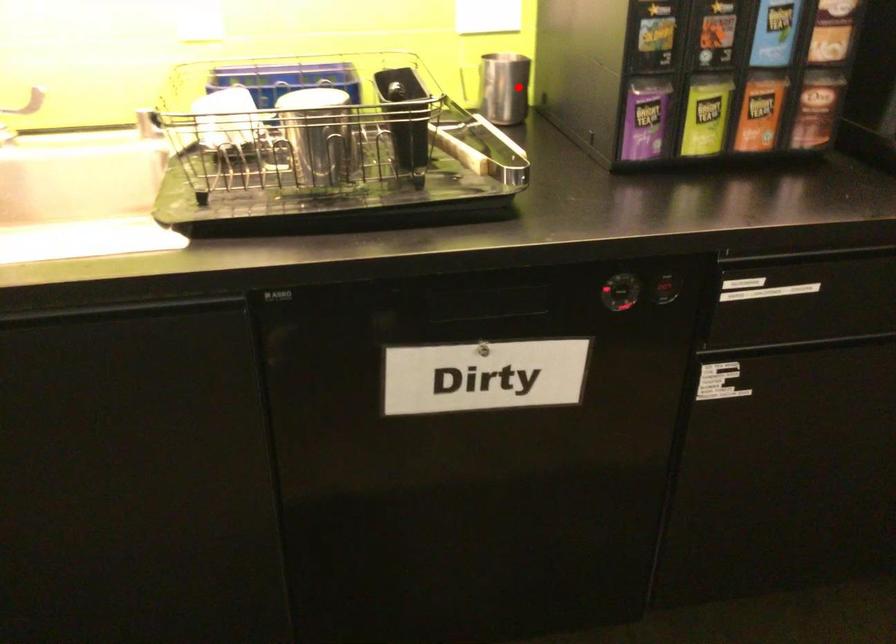
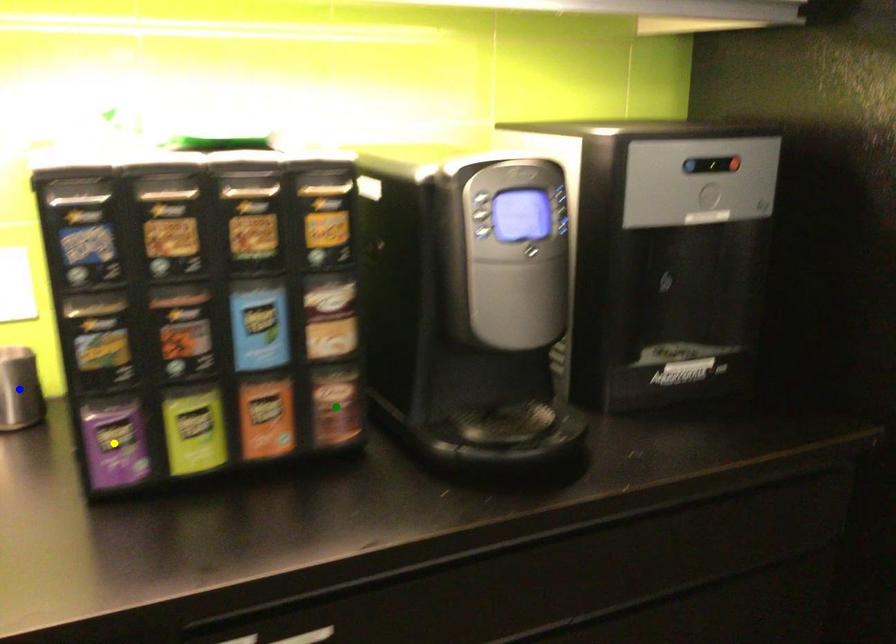
Question: I am providing you with two images of the same scene from different viewpoints. A red point is marked on the first image. You are given multiple points on the second image. Which point in image 2 represents the same 3d spot as the red point in image 1?

Choices:
 (A) green point
 (B) yellow point
 (C) blue point

Answer: (C)